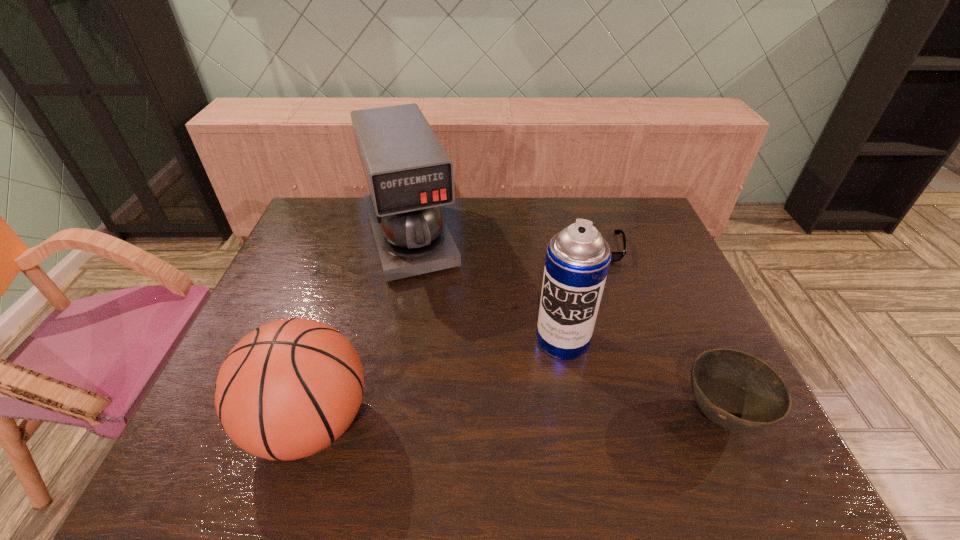
Find the location of a particular element. The width and height of the screenshot is (960, 540). free space located on the front-facing side of the shortest object is located at coordinates (586, 366).

Identify the location of free spot located on the front-facing side of the shortest object. (596, 276).

This screenshot has width=960, height=540. I want to click on free space located 0.060m on the front-facing side of the shortest object, so click(596, 276).

I want to click on vacant region located on the carafe side of the coffee maker, so click(429, 308).

This screenshot has height=540, width=960. What are the coordinates of `vacant area situated 0.140m on the carafe side of the coffee maker` in the screenshot? It's located at (432, 316).

Where is `free space located on the carafe side of the coffee maker`? The image size is (960, 540). free space located on the carafe side of the coffee maker is located at coordinates (444, 352).

The height and width of the screenshot is (540, 960). Identify the location of blank space located 0.080m on the label side of the aerosol can. (545, 385).

Locate an element on the screen. vacant space located on the label side of the aerosol can is located at coordinates (541, 395).

At what (x,y) coordinates should I click in order to perform the action: click on free spot located on the label side of the aerosol can. Please return your answer as a coordinate pair (x, y). Looking at the image, I should click on (540, 402).

The image size is (960, 540). What are the coordinates of `sunglasses at the far edge` in the screenshot? It's located at tap(615, 256).